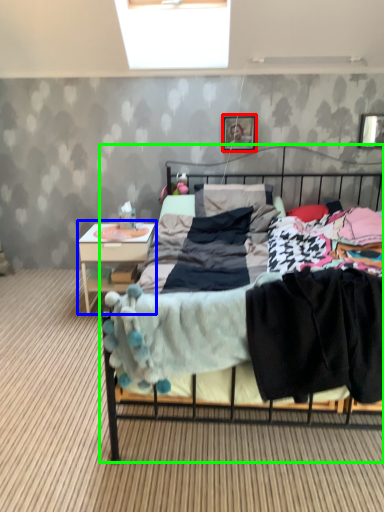
Question: Estimate the real-world distances between objects in this image. Which object is farther from picture frame (highlighted by a red box), nightstand (highlighted by a blue box) or bed (highlighted by a green box)?

Choices:
 (A) nightstand
 (B) bed

Answer: (A)